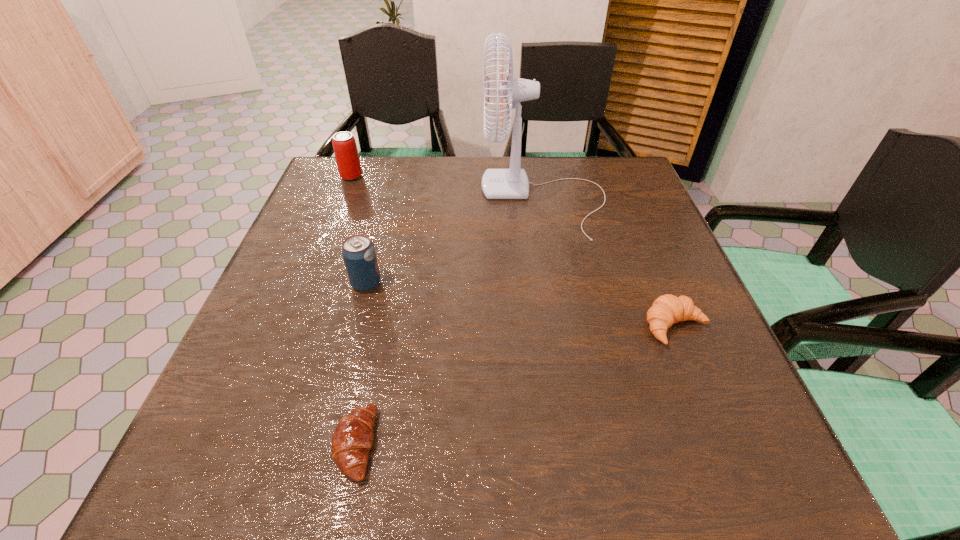
At what (x,y) coordinates should I click in order to perform the action: click on fan. Please return your answer as a coordinate pair (x, y). Image resolution: width=960 pixels, height=540 pixels. Looking at the image, I should click on (512, 183).

I want to click on the leftmost object, so (x=347, y=158).

The image size is (960, 540). What are the coordinates of `the third farthest object` in the screenshot? It's located at (358, 252).

The height and width of the screenshot is (540, 960). I want to click on the taller crescent roll, so click(x=666, y=310).

The height and width of the screenshot is (540, 960). Identify the location of the second shortest object. (666, 310).

I want to click on the nearest object, so click(353, 437).

Where is `the shorter crescent roll`? This screenshot has width=960, height=540. the shorter crescent roll is located at coordinates (353, 437).

Image resolution: width=960 pixels, height=540 pixels. I want to click on free space located 0.150m on the front-facing side of the fan, so click(423, 199).

This screenshot has height=540, width=960. I want to click on vacant space located on the front-facing side of the fan, so click(420, 199).

The width and height of the screenshot is (960, 540). Identify the location of free space located on the front-facing side of the fan. (361, 199).